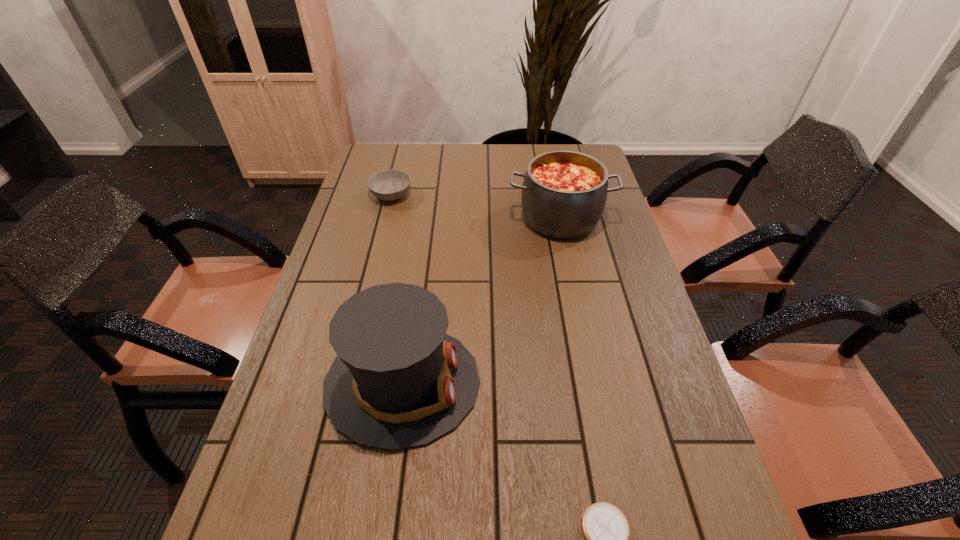
Identify the location of the third farthest object. (399, 381).

Locate an element on the screen. dress hat is located at coordinates (399, 381).

I want to click on the third shortest object, so click(x=564, y=192).

At what (x,y) coordinates should I click in order to perform the action: click on the second shortest object. Please return your answer as a coordinate pair (x, y). This screenshot has height=540, width=960. Looking at the image, I should click on (388, 185).

Find the location of a particular element. Image resolution: width=960 pixels, height=540 pixels. vacant region located with goggles on the front of the third farthest object is located at coordinates (626, 383).

Identify the location of vacant position located on the front of the second tallest object. point(572,276).

Where is `free space located on the right of the third tallest object`? The image size is (960, 540). free space located on the right of the third tallest object is located at coordinates (508, 195).

Locate an element on the screen. Image resolution: width=960 pixels, height=540 pixels. dress hat that is at the left edge is located at coordinates pyautogui.click(x=399, y=381).

Locate an element on the screen. Image resolution: width=960 pixels, height=540 pixels. bowl situated at the left edge is located at coordinates (388, 185).

Where is `object at the right edge`? The height and width of the screenshot is (540, 960). object at the right edge is located at coordinates (564, 192).